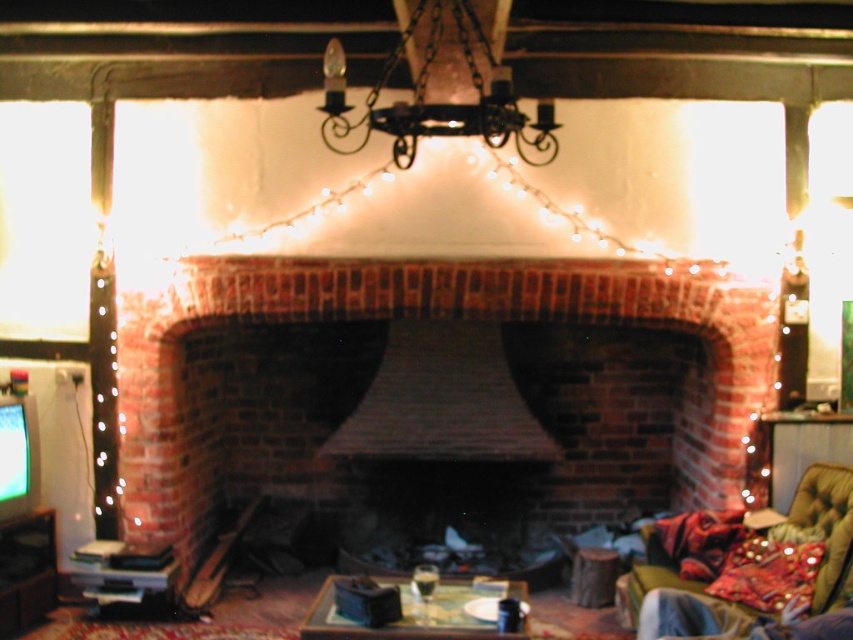
Can you confirm if black wrought iron chandelier at upper center is taller than matte black television at left?

Indeed, black wrought iron chandelier at upper center has a greater height compared to matte black television at left.

Which is above, black wrought iron chandelier at upper center or matte black television at left?

black wrought iron chandelier at upper center is above.

Where is `black wrought iron chandelier at upper center`? The image size is (853, 640). black wrought iron chandelier at upper center is located at coordinates tap(436, 102).

Find the location of a particular element. Image resolution: width=853 pixels, height=640 pixels. black wrought iron chandelier at upper center is located at coordinates (436, 102).

Is brick fireplace at center smaller than black wrought iron chandelier at upper center?

No, brick fireplace at center is not smaller than black wrought iron chandelier at upper center.

Which of these two, brick fireplace at center or black wrought iron chandelier at upper center, stands taller?

brick fireplace at center

Is point (662, 308) behind point (462, 33)?

Yes.

Find the location of a particular element. The width and height of the screenshot is (853, 640). brick fireplace at center is located at coordinates (427, 317).

Who is lower down, matte glass tray at center or matte black television at left?

matte black television at left is lower down.

Does point (496, 636) lie behind point (9, 589)?

That is False.

Is point (511, 637) behind point (50, 522)?

No, (511, 637) is in front of (50, 522).

Where is `matte glass tray at center`? Image resolution: width=853 pixels, height=640 pixels. matte glass tray at center is located at coordinates (419, 612).